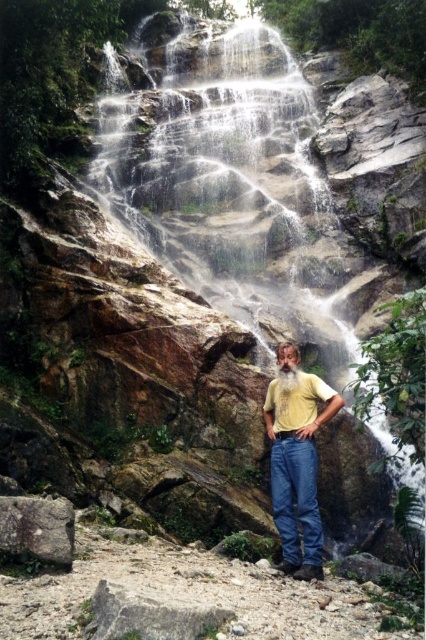
Is blue denim jeans at lower center positioned before smooth gray rock at lower left?

No, it is not.

Is blue denim jeans at lower center thinner than smooth gray rock at lower left?

Indeed, blue denim jeans at lower center has a lesser width compared to smooth gray rock at lower left.

Between point (302, 481) and point (63, 548), which one is positioned in front?

Point (63, 548) is more forward.

Locate an element on the screen. The width and height of the screenshot is (426, 640). blue denim jeans at lower center is located at coordinates (296, 499).

Is point (265, 412) farther from camera compared to point (19, 557)?

Yes.

Is yellow matte shirt at center taller than smooth gray rock at lower left?

Incorrect, yellow matte shirt at center's height is not larger of smooth gray rock at lower left's.

Describe the element at coordinates (296, 460) in the screenshot. I see `yellow matte shirt at center` at that location.

Where is `yellow matte shirt at center`? The image size is (426, 640). yellow matte shirt at center is located at coordinates (296, 460).

Looking at this image, can you confirm if yellow matte shirt at center is thinner than blue denim jeans at lower center?

Correct, yellow matte shirt at center's width is less than blue denim jeans at lower center's.

Who is positioned more to the left, yellow matte shirt at center or blue denim jeans at lower center?

blue denim jeans at lower center is more to the left.

Locate an element on the screen. The image size is (426, 640). yellow matte shirt at center is located at coordinates (296, 460).

Identify the location of yellow matte shirt at center. The height and width of the screenshot is (640, 426). (296, 460).